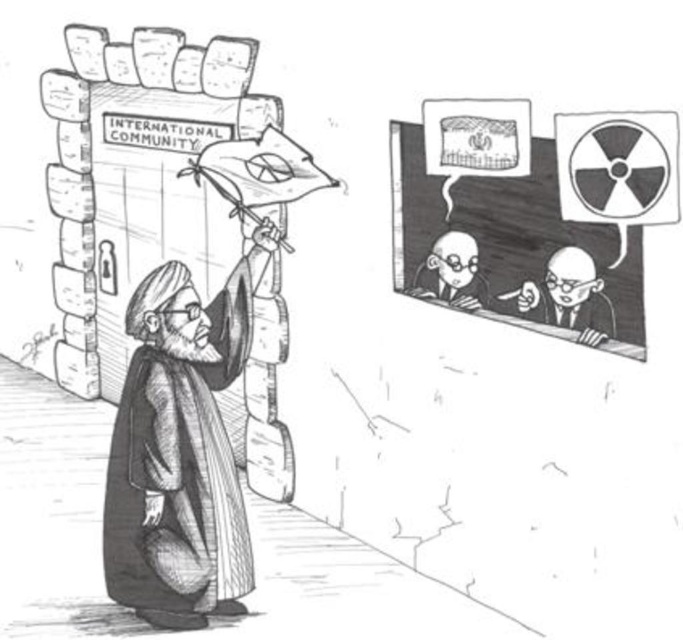
Which of these two, smooth paper flag at upper center or smooth skin bald man at center, stands shorter?

Standing shorter between the two is smooth skin bald man at center.

Which of these two, smooth paper flag at upper center or smooth skin bald man at center, stands taller?

Standing taller between the two is smooth paper flag at upper center.

Is point (563, 211) closer to camera compared to point (446, 298)?

Yes, point (563, 211) is closer to viewer.

You are a GUI agent. You are given a task and a screenshot of the screen. Output one action in this format:
    pyautogui.click(x=<x>, y=<y>)
    Task: Click on the smooth paper flag at upper center
    Image resolution: width=683 pixels, height=640 pixels.
    Given the screenshot: What is the action you would take?
    pyautogui.click(x=531, y=214)

Who is more distant from viewer, (139, 584) or (460, 241)?

The point (460, 241) is more distant.

Does point (152, 356) come in front of point (473, 262)?

Yes, point (152, 356) is closer to viewer.

At what (x,y) coordinates should I click in order to perform the action: click on smooth woolen robe at center. Please return your answer as a coordinate pair (x, y). Looking at the image, I should click on (178, 458).

Does point (635, 150) come behind point (223, 449)?

No.

Who is more forward, [475,109] or [156,547]?

Positioned in front is point [156,547].

Is point (484, 132) closer to viewer compared to point (236, 586)?

Yes.

The width and height of the screenshot is (683, 640). Find the location of `smooth paper flag at upper center`. smooth paper flag at upper center is located at coordinates coord(531,214).